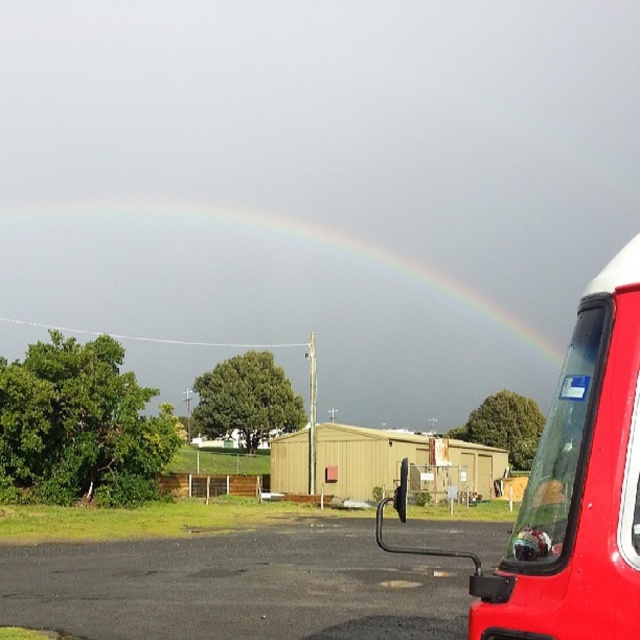
You are standing on the black asphalt parking lot at lower left and want to see the shiny red truck at right. Can you see it without moving?

The shiny red truck at right is behind the black asphalt parking lot at lower left, so you cannot see it without moving.

Looking at this image, you are standing in the scene and want to reach the point at coordinates (346,525). The red vehicle is blocking your path. Can you walk around it to reach the point?

The point at coordinates (346,525) is 104.35 feet away from the viewer. Since the red vehicle is blocking the direct path, you can walk around it to reach the point as long as there is a clear path around the vehicle.

You are a photographer trying to capture the rainbow at upper center while also including the shiny red truck at right in your shot. Based on their positions, can you determine which object is more to the right in the image?

The shiny red truck at right is positioned on the right side of the rainbow at upper center, so it is more to the right in the image.